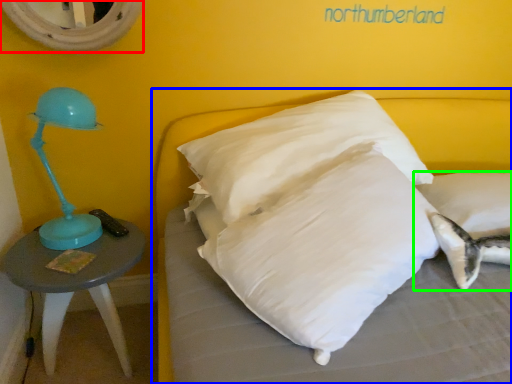
Question: Estimate the real-world distances between objects in this image. Which object is closer to mirror (highlighted by a red box), bed (highlighted by a blue box) or pillow (highlighted by a green box)?

Choices:
 (A) bed
 (B) pillow

Answer: (A)